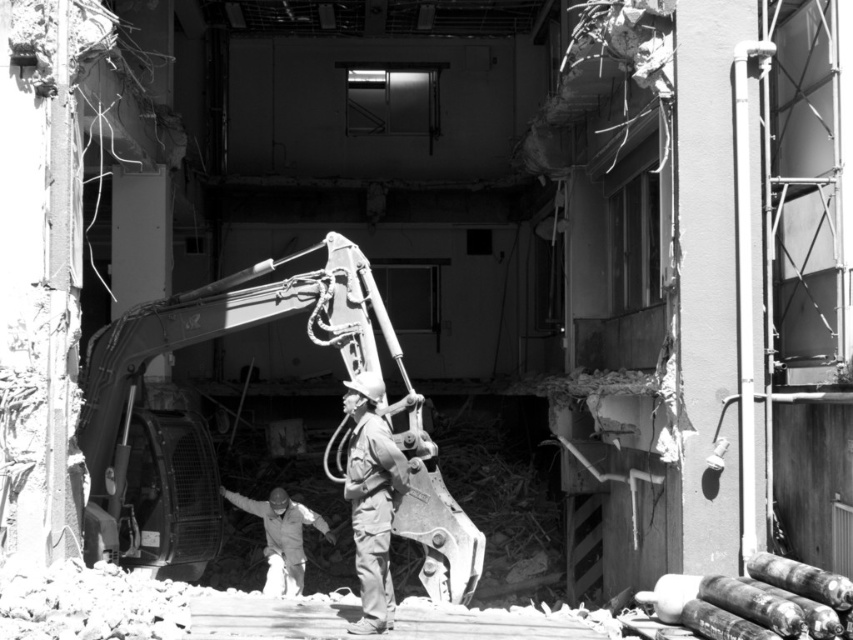
Can you confirm if camouflage fabric uniform at center is bigger than white hard hat at center?

Incorrect, camouflage fabric uniform at center is not larger than white hard hat at center.

Does camouflage fabric uniform at center appear on the right side of white hard hat at center?

Indeed, camouflage fabric uniform at center is positioned on the right side of white hard hat at center.

What do you see at coordinates (370, 499) in the screenshot? I see `camouflage fabric uniform at center` at bounding box center [370, 499].

Identify the location of camouflage fabric uniform at center. (370, 499).

Who is positioned more to the left, metallic gray excavator at center or camouflage fabric uniform at center?

camouflage fabric uniform at center

Is metallic gray excavator at center below camouflage fabric uniform at center?

Correct, metallic gray excavator at center is located below camouflage fabric uniform at center.

Between point (271, 314) and point (355, 472), which one is positioned behind?

Positioned behind is point (271, 314).

At what (x,y) coordinates should I click in order to perform the action: click on metallic gray excavator at center. Please return your answer as a coordinate pair (x, y). The width and height of the screenshot is (853, 640). Looking at the image, I should click on (312, 342).

Is metallic gray excavator at center closer to the viewer compared to white hard hat at center?

Yes, it is in front of white hard hat at center.

Is metallic gray excavator at center below white hard hat at center?

Actually, metallic gray excavator at center is above white hard hat at center.

This screenshot has width=853, height=640. In order to click on metallic gray excavator at center in this screenshot , I will do `click(312, 342)`.

Image resolution: width=853 pixels, height=640 pixels. In order to click on metallic gray excavator at center in this screenshot , I will do `click(312, 342)`.